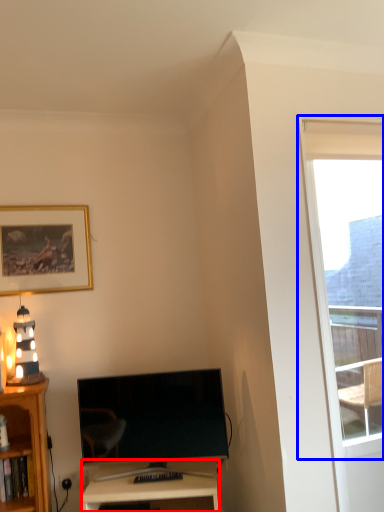
Question: Among these objects, which one is farthest to the camera, desk (highlighted by a red box) or window (highlighted by a blue box)?

Choices:
 (A) desk
 (B) window

Answer: (A)